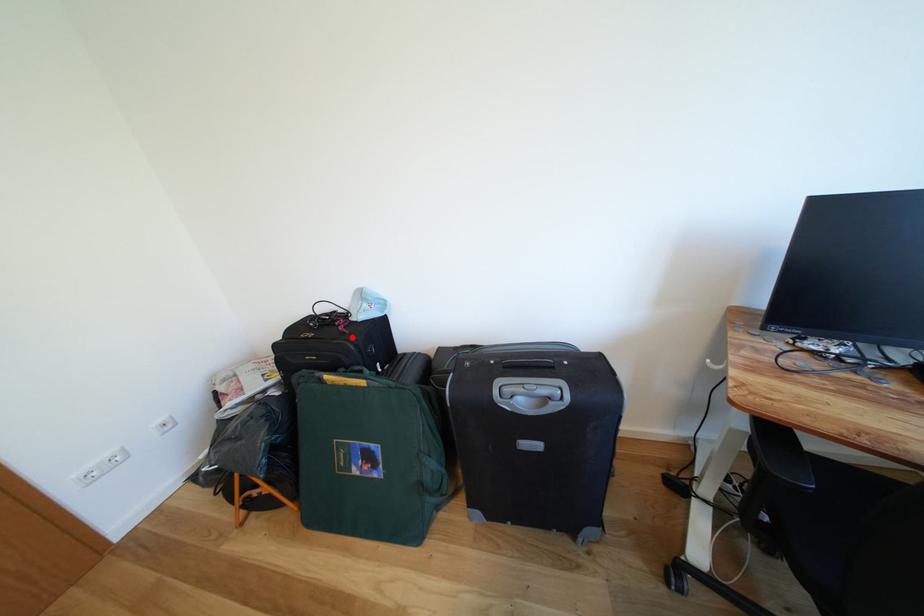
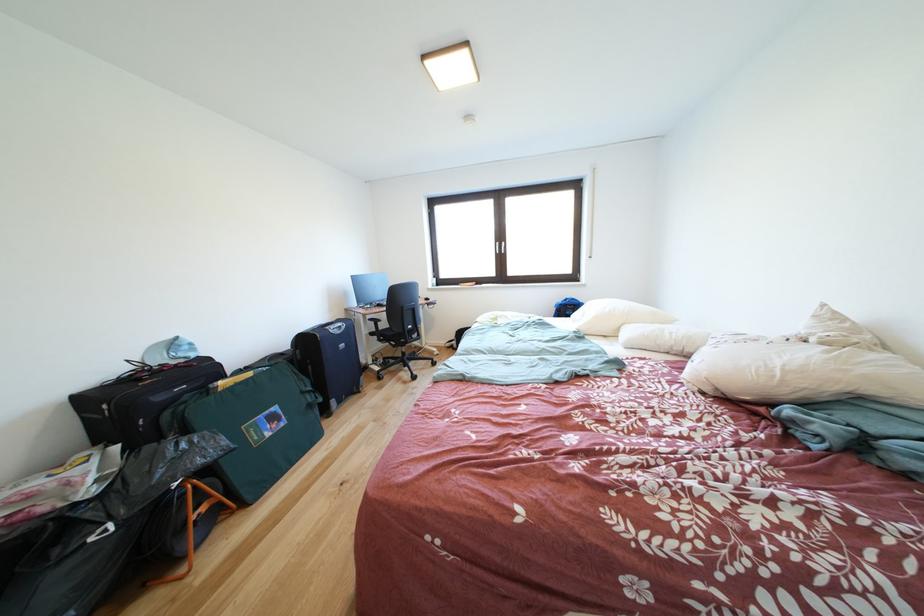
Find the pixel in the second image that matches the highlighted location in the first image.

(200, 371)